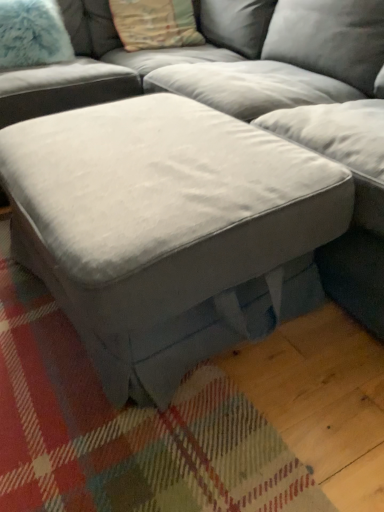
At what (x,y) coordinates should I click in order to perform the action: click on suede gray ottoman at center. Please return your answer as a coordinate pair (x, y). Looking at the image, I should click on (284, 101).

Locate an element on the screen. This screenshot has height=512, width=384. suede gray ottoman at center is located at coordinates (284, 101).

From the image's perspective, between suede gray ottoman at center and textured beige pillow at upper center, arranged as the 1th pillow when viewed from the right, who is located below?

suede gray ottoman at center is shown below in the image.

Considering the positions of points (301, 140) and (139, 13), is point (301, 140) closer to camera compared to point (139, 13)?

That is True.

Are suede gray ottoman at center and textured beige pillow at upper center, the second pillow positioned from the left, far apart?

No, suede gray ottoman at center is not far from textured beige pillow at upper center, the second pillow positioned from the left.

From a real-world perspective, who is located lower, suede gray ottoman at center or textured beige pillow at upper center, arranged as the 1th pillow when viewed from the right?

From a 3D spatial view, suede gray ottoman at center is below.

Which is behind, fuzzy white pillow at upper left, the 2th pillow viewed from the right, or suede gray ottoman at center?

fuzzy white pillow at upper left, the 2th pillow viewed from the right, is further away from the camera.

Locate an element on the screen. The width and height of the screenshot is (384, 512). pillow that is the 1st one when counting upward from the suede gray ottoman at center (from the image's perspective) is located at coordinates (32, 34).

From their relative heights in the image, would you say fuzzy white pillow at upper left, which is the 1th pillow in left-to-right order, is taller or shorter than suede gray ottoman at center?

Considering their sizes, fuzzy white pillow at upper left, which is the 1th pillow in left-to-right order, has less height than suede gray ottoman at center.

Is point (37, 14) farther from viewer compared to point (337, 6)?

That is True.

Is suede gray ottoman at center not within fuzzy white pillow at upper left, which is the 1th pillow in left-to-right order?

suede gray ottoman at center is positioned outside fuzzy white pillow at upper left, which is the 1th pillow in left-to-right order.

Looking at this image, is suede gray ottoman at center aimed at fuzzy white pillow at upper left, which is the 1th pillow in left-to-right order?

No, suede gray ottoman at center is not turned towards fuzzy white pillow at upper left, which is the 1th pillow in left-to-right order.

Does suede gray ottoman at center touch fuzzy white pillow at upper left, the 2th pillow viewed from the right?

suede gray ottoman at center and fuzzy white pillow at upper left, the 2th pillow viewed from the right, are not in contact.

In the scene shown: Which is in front, suede gray ottoman at center or fuzzy white pillow at upper left, the 2th pillow viewed from the right?

suede gray ottoman at center is closer to the camera.

From the image's perspective, between fuzzy white pillow at upper left, the 2th pillow viewed from the right, and textured beige pillow at upper center, arranged as the 1th pillow when viewed from the right, which one is located above?

From the image's view, textured beige pillow at upper center, arranged as the 1th pillow when viewed from the right, is above.

How different are the orientations of fuzzy white pillow at upper left, the 2th pillow viewed from the right, and textured beige pillow at upper center, the second pillow positioned from the left, in degrees?

The angular difference between fuzzy white pillow at upper left, the 2th pillow viewed from the right, and textured beige pillow at upper center, the second pillow positioned from the left, is 2.24 degrees.

Considering the positions of objects fuzzy white pillow at upper left, the 2th pillow viewed from the right, and textured beige pillow at upper center, arranged as the 1th pillow when viewed from the right, in the image provided, who is more to the left, fuzzy white pillow at upper left, the 2th pillow viewed from the right, or textured beige pillow at upper center, arranged as the 1th pillow when viewed from the right,?

Positioned to the left is fuzzy white pillow at upper left, the 2th pillow viewed from the right.

Can you confirm if fuzzy white pillow at upper left, the 2th pillow viewed from the right, is wider than textured beige pillow at upper center, arranged as the 1th pillow when viewed from the right?

In fact, fuzzy white pillow at upper left, the 2th pillow viewed from the right, might be narrower than textured beige pillow at upper center, arranged as the 1th pillow when viewed from the right.

In the scene shown: Is textured beige pillow at upper center, arranged as the 1th pillow when viewed from the right, bigger or smaller than fuzzy white pillow at upper left, the 2th pillow viewed from the right?

Considering their sizes, textured beige pillow at upper center, arranged as the 1th pillow when viewed from the right, takes up more space than fuzzy white pillow at upper left, the 2th pillow viewed from the right.

Between textured beige pillow at upper center, arranged as the 1th pillow when viewed from the right, and fuzzy white pillow at upper left, the 2th pillow viewed from the right, which one has larger width?

textured beige pillow at upper center, arranged as the 1th pillow when viewed from the right.

Which is behind, point (178, 41) or point (29, 41)?

The point (178, 41) is farther from the camera.

Could you tell me if textured beige pillow at upper center, arranged as the 1th pillow when viewed from the right, is facing fuzzy white pillow at upper left, which is the 1th pillow in left-to-right order?

No.

Looking at this image, is suede gray ottoman at center inside textured beige pillow at upper center, arranged as the 1th pillow when viewed from the right?

Actually, suede gray ottoman at center is outside textured beige pillow at upper center, arranged as the 1th pillow when viewed from the right.

Does textured beige pillow at upper center, the second pillow positioned from the left, have a lesser width compared to suede gray ottoman at center?

Yes, textured beige pillow at upper center, the second pillow positioned from the left, is thinner than suede gray ottoman at center.

From a real-world perspective, between textured beige pillow at upper center, the second pillow positioned from the left, and suede gray ottoman at center, who is vertically higher?

textured beige pillow at upper center, the second pillow positioned from the left, is physically above.

At what (x,y) coordinates should I click in order to perform the action: click on studio couch on the right of textured beige pillow at upper center, arranged as the 1th pillow when viewed from the right. Please return your answer as a coordinate pair (x, y). Looking at the image, I should click on (284, 101).

This screenshot has width=384, height=512. Find the location of `pillow that is the 1st one when counting upward from the suede gray ottoman at center (from the image's perspective)`. pillow that is the 1st one when counting upward from the suede gray ottoman at center (from the image's perspective) is located at coordinates (32, 34).

Considering their positions, is textured beige pillow at upper center, arranged as the 1th pillow when viewed from the right, positioned further to fuzzy white pillow at upper left, the 2th pillow viewed from the right, than suede gray ottoman at center?

Result: suede gray ottoman at center lies further to fuzzy white pillow at upper left, the 2th pillow viewed from the right, than the other object.

Considering their positions, is suede gray ottoman at center positioned closer to fuzzy white pillow at upper left, which is the 1th pillow in left-to-right order, than textured beige pillow at upper center, the second pillow positioned from the left?

The object closer to fuzzy white pillow at upper left, which is the 1th pillow in left-to-right order, is textured beige pillow at upper center, the second pillow positioned from the left.

Which object lies further to the anchor point textured beige pillow at upper center, the second pillow positioned from the left, fuzzy white pillow at upper left, which is the 1th pillow in left-to-right order, or suede gray ottoman at center?

suede gray ottoman at center.

From the image, which object appears to be nearer to suede gray ottoman at center, fuzzy white pillow at upper left, which is the 1th pillow in left-to-right order, or textured beige pillow at upper center, arranged as the 1th pillow when viewed from the right?

textured beige pillow at upper center, arranged as the 1th pillow when viewed from the right, is closer to suede gray ottoman at center.

When comparing their distances from textured beige pillow at upper center, the second pillow positioned from the left, does suede gray ottoman at center or fuzzy white pillow at upper left, which is the 1th pillow in left-to-right order, seem closer?

fuzzy white pillow at upper left, which is the 1th pillow in left-to-right order, lies closer to textured beige pillow at upper center, the second pillow positioned from the left, than the other object.

Based on their spatial positions, is textured beige pillow at upper center, arranged as the 1th pillow when viewed from the right, or fuzzy white pillow at upper left, the 2th pillow viewed from the right, further from suede gray ottoman at center?

fuzzy white pillow at upper left, the 2th pillow viewed from the right, is positioned further to the anchor suede gray ottoman at center.

The height and width of the screenshot is (512, 384). I want to click on pillow between suede gray ottoman at center and textured beige pillow at upper center, arranged as the 1th pillow when viewed from the right, from front to back, so click(32, 34).